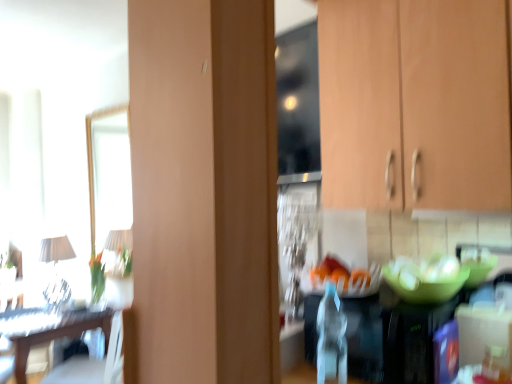
Question: Should I look upward or downward to see green matte glass bowl at center?

Choices:
 (A) up
 (B) down

Answer: (B)

Question: Can you confirm if wooden table at left is thinner than wooden cabinet at upper right?

Choices:
 (A) yes
 (B) no

Answer: (B)

Question: From the image's perspective, is wooden table at left located beneath wooden cabinet at upper right?

Choices:
 (A) no
 (B) yes

Answer: (B)

Question: Is wooden table at left positioned with its back to wooden cabinet at upper right?

Choices:
 (A) yes
 (B) no

Answer: (B)

Question: Can you confirm if wooden table at left is bigger than wooden cabinet at upper right?

Choices:
 (A) yes
 (B) no

Answer: (A)

Question: Is wooden table at left positioned beyond the bounds of wooden cabinet at upper right?

Choices:
 (A) no
 (B) yes

Answer: (B)

Question: Is wooden table at left behind wooden cabinet at upper right?

Choices:
 (A) yes
 (B) no

Answer: (A)

Question: Could white fabric lampshade at left be considered to be inside wooden table at left?

Choices:
 (A) no
 (B) yes

Answer: (A)

Question: Does wooden table at left have a smaller size compared to white fabric lampshade at left?

Choices:
 (A) no
 (B) yes

Answer: (A)

Question: Can you confirm if wooden table at left is shorter than white fabric lampshade at left?

Choices:
 (A) yes
 (B) no

Answer: (B)

Question: Is wooden table at left turned away from white fabric lampshade at left?

Choices:
 (A) no
 (B) yes

Answer: (A)

Question: Is wooden table at left taller than white fabric lampshade at left?

Choices:
 (A) no
 (B) yes

Answer: (B)

Question: Are wooden table at left and white fabric lampshade at left making contact?

Choices:
 (A) yes
 (B) no

Answer: (B)

Question: Are green matte glass bowl at center and wooden cabinet at upper right making contact?

Choices:
 (A) no
 (B) yes

Answer: (A)